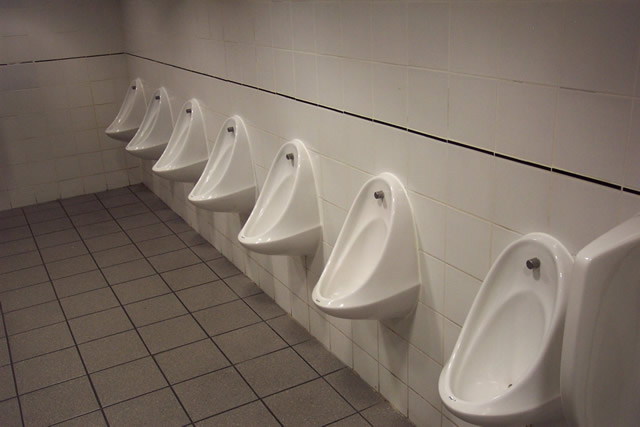
Identify the location of urinals in a bathroom. The height and width of the screenshot is (427, 640). (139, 98), (156, 119), (188, 136), (226, 162), (278, 191), (347, 233), (508, 323).